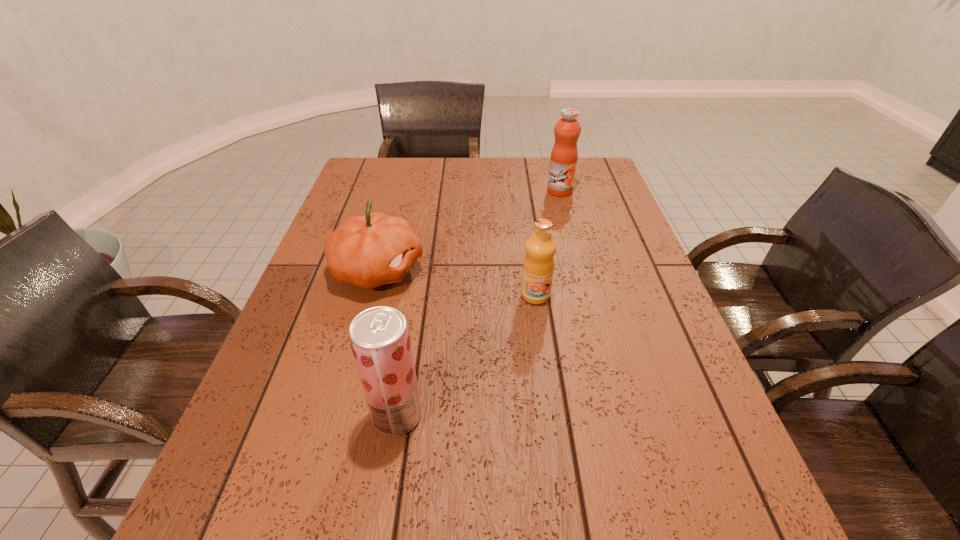
At what (x,y) coordinates should I click in order to perform the action: click on blank area located 0.100m on the front face of the pumpkin. Please return your answer as a coordinate pair (x, y). Looking at the image, I should click on (464, 271).

Locate an element on the screen. The image size is (960, 540). object located in the far edge section of the desktop is located at coordinates (563, 162).

You are a GUI agent. You are given a task and a screenshot of the screen. Output one action in this format:
    pyautogui.click(x=<x>, y=<y>)
    Task: Click on the object that is positioned at the left edge
    This screenshot has height=540, width=960.
    Given the screenshot: What is the action you would take?
    pyautogui.click(x=368, y=251)

Locate an element on the screen. Image resolution: width=960 pixels, height=540 pixels. object present at the right edge is located at coordinates (563, 162).

At what (x,y) coordinates should I click in order to perform the action: click on object at the far right corner. Please return your answer as a coordinate pair (x, y). This screenshot has width=960, height=540. Looking at the image, I should click on (563, 162).

Find the location of a particular element. This screenshot has height=540, width=960. vacant space at the far edge of the desktop is located at coordinates (459, 191).

Locate an element on the screen. vacant region at the left edge of the desktop is located at coordinates (362, 207).

At what (x,y) coordinates should I click in order to perform the action: click on vacant space at the right edge of the desktop. Please return your answer as a coordinate pair (x, y). Looking at the image, I should click on (692, 440).

This screenshot has width=960, height=540. In the image, there is a desktop. What are the coordinates of `vacant space at the far left corner` in the screenshot? It's located at (356, 173).

Identify the location of free space between the rightmost object and the pumpkin. (468, 231).